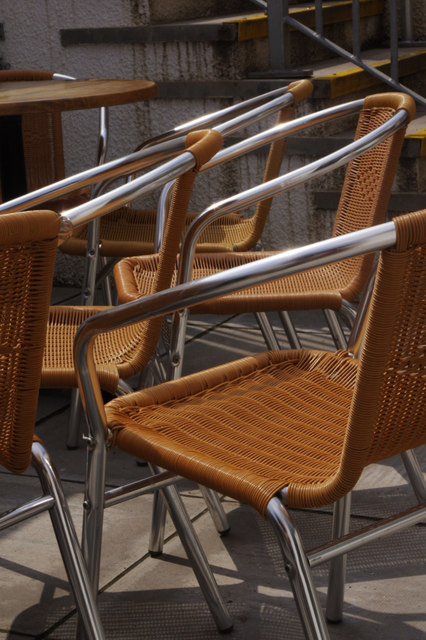
What are the coordinates of `stair wall` in the screenshot? It's located at (92, 66).